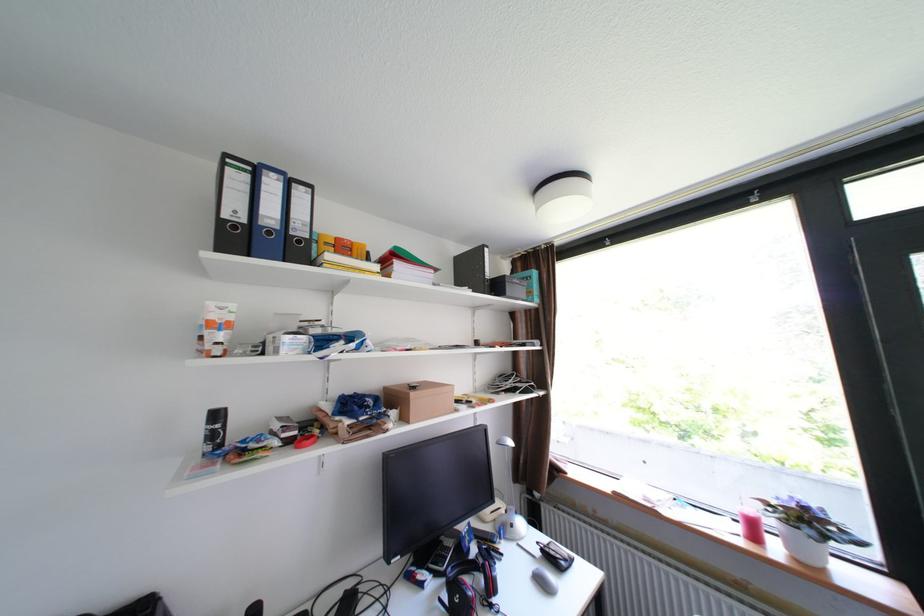
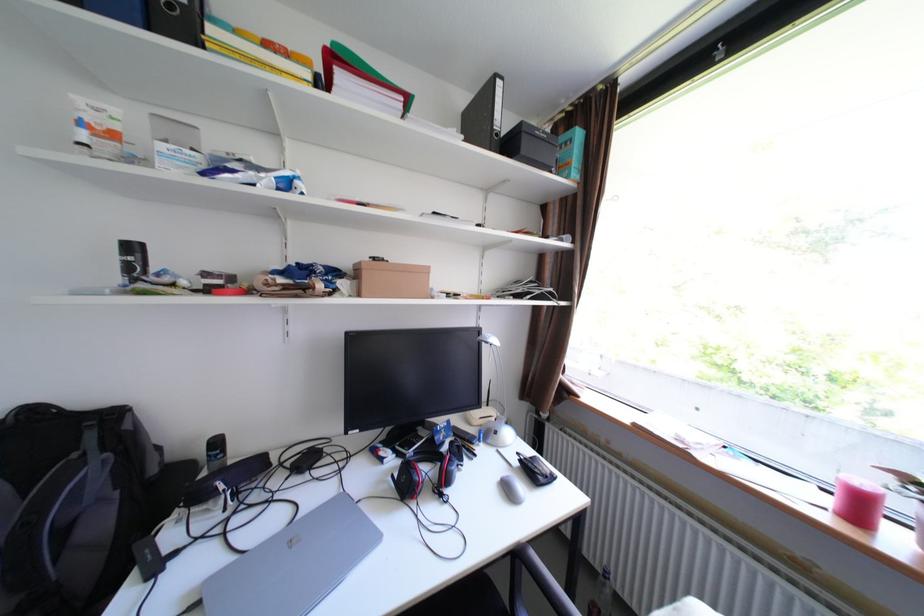
The point at (552, 583) is marked in the first image. Where is the corresponding point in the second image?

(517, 490)